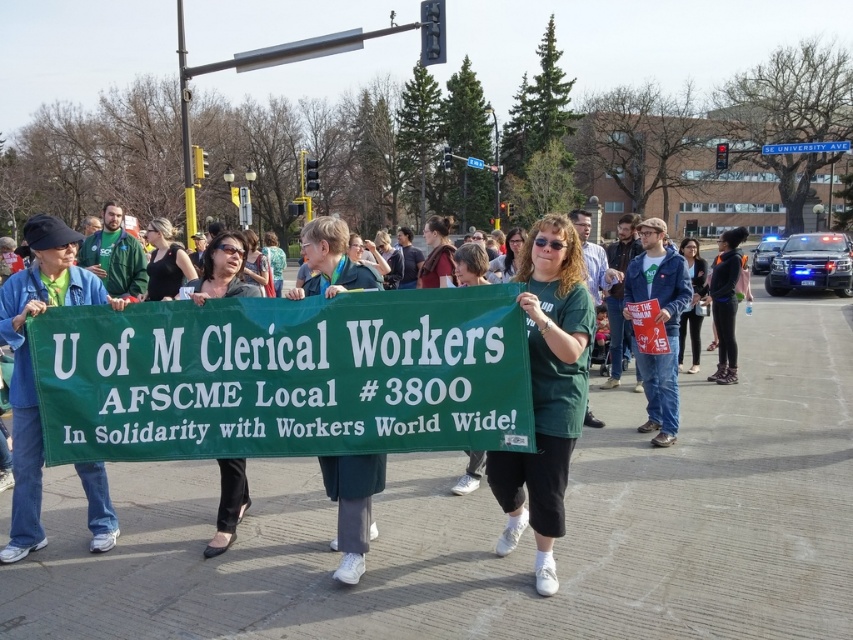
Question: Which of the following is the closest to the observer?

Choices:
 (A) (694, 256)
 (B) (227, 531)

Answer: (B)

Question: Is green fabric banner at center to the right of black fabric shirt at center from the viewer's perspective?

Choices:
 (A) yes
 (B) no

Answer: (A)

Question: Among these objects, which one is nearest to the camera?

Choices:
 (A) black fabric shirt at center
 (B) green fabric banner at center

Answer: (B)

Question: Which point is farther from the camera taking this photo?

Choices:
 (A) (695, 257)
 (B) (196, 275)
 (C) (236, 264)

Answer: (A)

Question: Where is black fabric shirt at center located in relation to dark blue jeans at center in the image?

Choices:
 (A) right
 (B) left

Answer: (B)

Question: Is black fabric shirt at center below dark blue jeans at center?

Choices:
 (A) yes
 (B) no

Answer: (B)